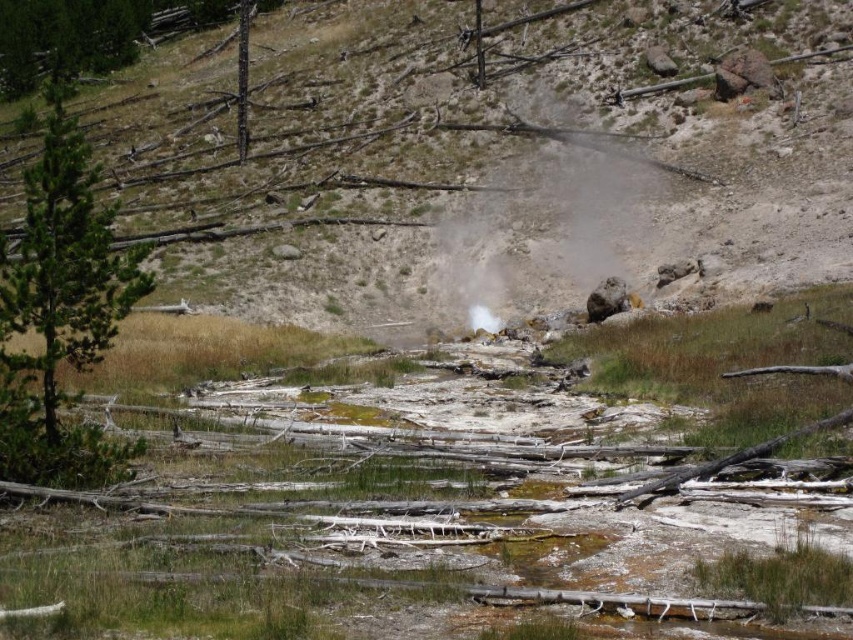
You are a geologist examining the terrain. You notice the dull brown dirt at center and the green matte tree at left. Which object is elevated higher in the landscape?

The dull brown dirt at center is taller than the green matte tree at left, so the dull brown dirt at center is elevated higher in the landscape.

You are standing in the geothermal area and want to take a photo of the white vapor at center. To include the green matte tree at left in your shot, should you zoom in or zoom out?

To include both the green matte tree at left and the white vapor at center in your photo, you should zoom out. The green matte tree at left is positioned to the left of white vapor at center, so zooming out will widen your field of view to capture both objects.